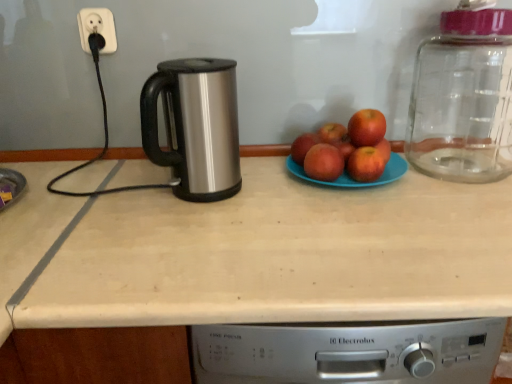
Question: Does beige laminate countertop at center have a greater width compared to blue matte plate at center?

Choices:
 (A) yes
 (B) no

Answer: (A)

Question: Considering the relative positions of beige laminate countertop at center and blue matte plate at center in the image provided, is beige laminate countertop at center behind blue matte plate at center?

Choices:
 (A) yes
 (B) no

Answer: (B)

Question: Is beige laminate countertop at center next to blue matte plate at center and touching it?

Choices:
 (A) no
 (B) yes

Answer: (A)

Question: Is beige laminate countertop at center aimed at blue matte plate at center?

Choices:
 (A) no
 (B) yes

Answer: (A)

Question: Is blue matte plate at center located within beige laminate countertop at center?

Choices:
 (A) no
 (B) yes

Answer: (A)

Question: From a real-world perspective, is red matte apple at center, the 4th apple from the back, positioned above or below polished stainless steel kettle at center?

Choices:
 (A) below
 (B) above

Answer: (A)

Question: Is red matte apple at center, the 4th apple from the back, spatially inside polished stainless steel kettle at center, or outside of it?

Choices:
 (A) inside
 (B) outside

Answer: (B)

Question: Is red matte apple at center, placed as the 2th apple when sorted from front to back, bigger or smaller than polished stainless steel kettle at center?

Choices:
 (A) small
 (B) big

Answer: (A)

Question: From the image's perspective, relative to polished stainless steel kettle at center, is red matte apple at center, placed as the 2th apple when sorted from front to back, above or below?

Choices:
 (A) below
 (B) above

Answer: (A)

Question: Is point (52, 259) positioned closer to the camera than point (381, 162)?

Choices:
 (A) closer
 (B) farther

Answer: (A)

Question: In terms of width, does beige laminate countertop at center look wider or thinner when compared to red matte apple at center, the 4th apple from the back?

Choices:
 (A) thin
 (B) wide

Answer: (B)

Question: In the image, is beige laminate countertop at center positioned in front of or behind red matte apple at center, the 4th apple from the back?

Choices:
 (A) front
 (B) behind

Answer: (A)

Question: Do you think beige laminate countertop at center is within red matte apple at center, the 4th apple from the back, or outside of it?

Choices:
 (A) inside
 (B) outside

Answer: (B)

Question: From a real-world perspective, is beige laminate countertop at center above or below red matte apple at center, the 2th apple in the back-to-front sequence?

Choices:
 (A) above
 (B) below

Answer: (B)

Question: Looking at the image, does beige laminate countertop at center seem bigger or smaller compared to red matte apple at center, the 2th apple in the back-to-front sequence?

Choices:
 (A) small
 (B) big

Answer: (B)